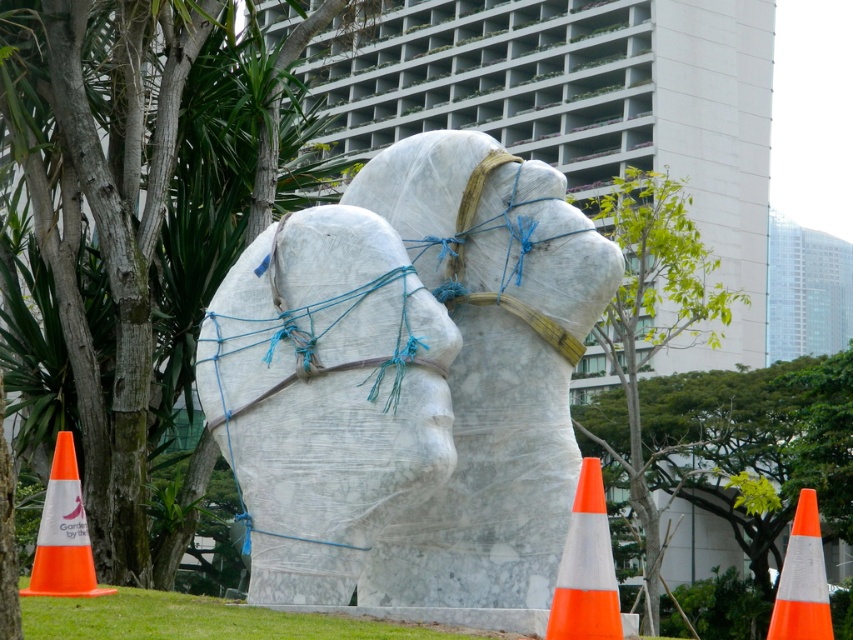
Is white marble statue at center in front of orange reflective cone at lower right?

Yes.

Which is more to the right, white marble statue at center or orange reflective cone at lower right?

orange reflective cone at lower right

Is point (392, 452) closer to camera compared to point (822, 596)?

That is True.

Image resolution: width=853 pixels, height=640 pixels. I want to click on white marble statue at center, so click(x=407, y=384).

Is orange plastic traffic cone at lower left bigger than orange reflective cone at lower right?

Indeed, orange plastic traffic cone at lower left has a larger size compared to orange reflective cone at lower right.

Between point (70, 480) and point (811, 570), which one is positioned behind?

The point (70, 480) is behind.

Which is in front, point (64, 560) or point (809, 604)?

Positioned in front is point (809, 604).

Locate an element on the screen. orange plastic traffic cone at lower left is located at coordinates (62, 532).

Is orange/white traffic cone at lower right thinner than orange reflective cone at lower right?

Indeed, orange/white traffic cone at lower right has a lesser width compared to orange reflective cone at lower right.

Which is in front, point (596, 472) or point (782, 593)?

Positioned in front is point (596, 472).

Where is `orange/white traffic cone at lower right`? This screenshot has width=853, height=640. orange/white traffic cone at lower right is located at coordinates (585, 568).

At what (x,y) coordinates should I click in order to perform the action: click on orange/white traffic cone at lower right. Please return your answer as a coordinate pair (x, y). The width and height of the screenshot is (853, 640). Looking at the image, I should click on (585, 568).